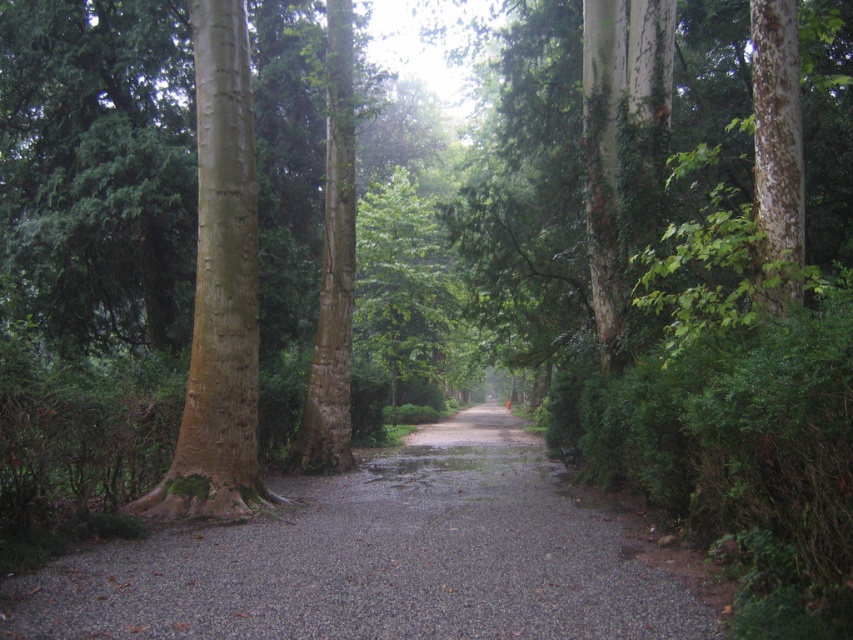
Question: Can you confirm if gray gravel alley at center is smaller than brown rough bark tree at left?

Choices:
 (A) no
 (B) yes

Answer: (A)

Question: Is gray gravel alley at center wider than brown rough bark tree at left?

Choices:
 (A) yes
 (B) no

Answer: (A)

Question: Among these points, which one is farthest from the camera?

Choices:
 (A) (184, 452)
 (B) (426, 636)

Answer: (A)

Question: Does gray gravel alley at center appear over brown rough bark tree at left?

Choices:
 (A) yes
 (B) no

Answer: (B)